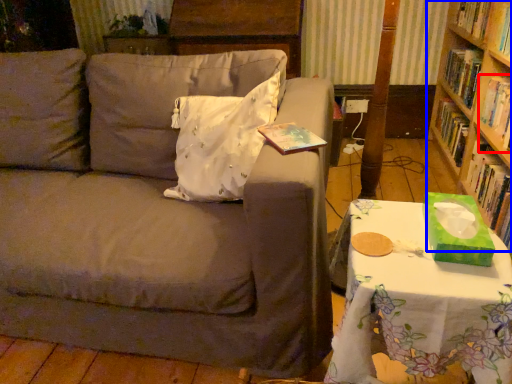
Question: Which object appears farthest to the camera in this image, book (highlighted by a red box) or bookcase (highlighted by a blue box)?

Choices:
 (A) book
 (B) bookcase

Answer: (A)